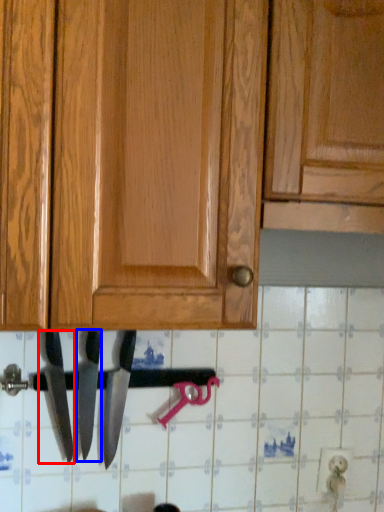
Question: Among these objects, which one is farthest to the camera, knife (highlighted by a red box) or knife (highlighted by a blue box)?

Choices:
 (A) knife
 (B) knife

Answer: (B)